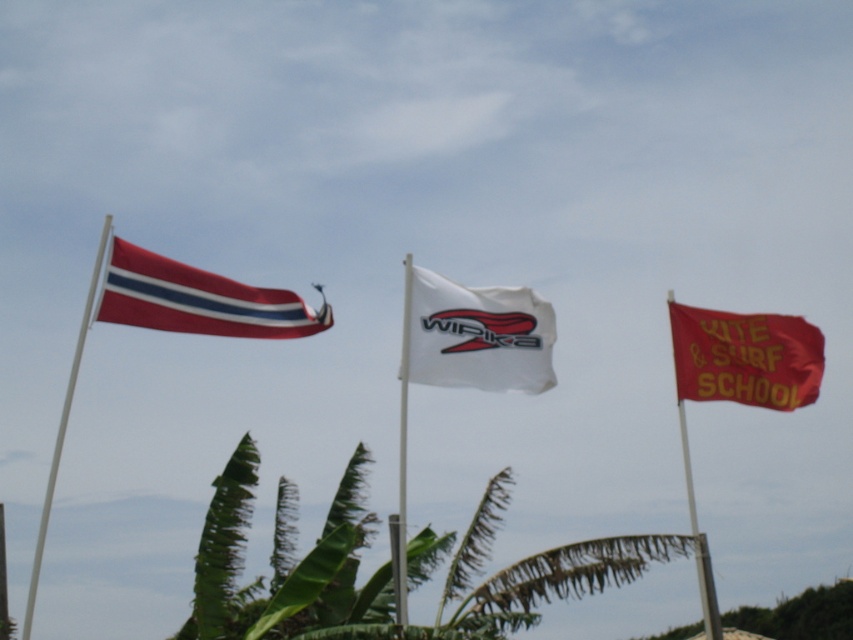
Question: Which point appears closest to the camera in this image?

Choices:
 (A) (36, 540)
 (B) (463, 289)
 (C) (403, 474)
 (D) (322, 314)

Answer: (C)

Question: Does white fabric flag at center appear over white plastic flag pole at center?

Choices:
 (A) yes
 (B) no

Answer: (A)

Question: Which of the following is the closest to the observer?

Choices:
 (A) red fabric flag at right
 (B) white plastic flag pole at left
 (C) red fabric kite surf school flag at right

Answer: (B)

Question: Does red and white striped flag at left appear over red fabric kite surf school flag at right?

Choices:
 (A) no
 (B) yes

Answer: (B)

Question: Which of the following is the farthest from the observer?

Choices:
 (A) red fabric kite surf school flag at right
 (B) white plastic flag pole at left

Answer: (A)

Question: Does red and white striped flag at left come in front of white plastic flag pole at left?

Choices:
 (A) yes
 (B) no

Answer: (B)